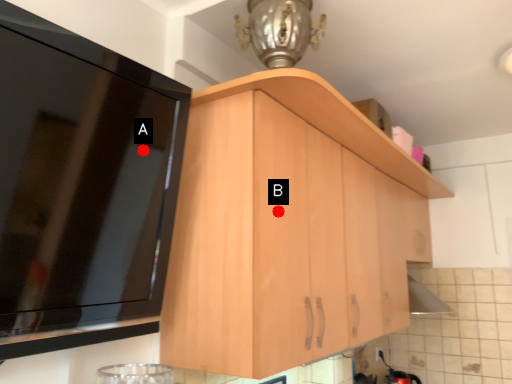
Question: Two points are circled on the image, labeled by A and B beside each circle. Which of the following is the farthest from the observer?

Choices:
 (A) A is further
 (B) B is further

Answer: (B)